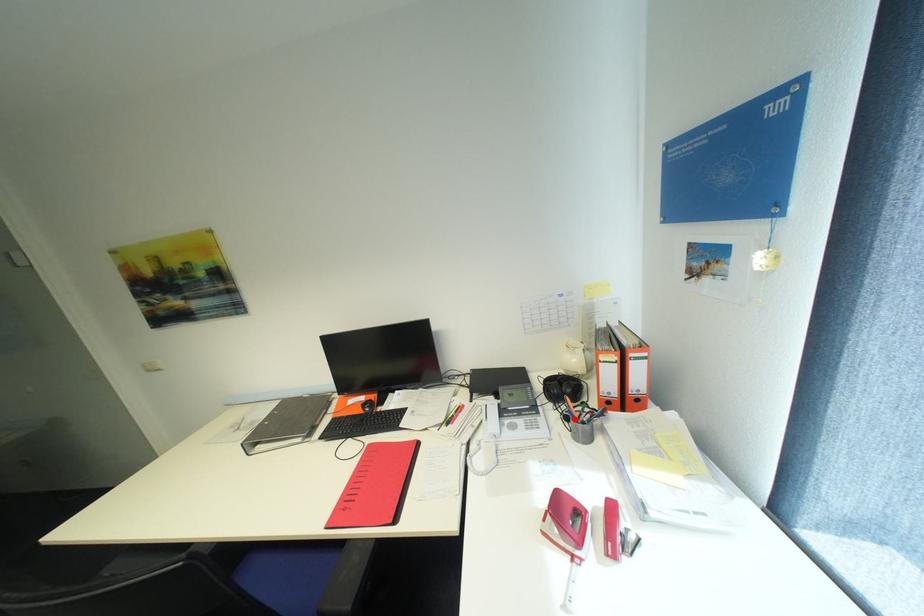
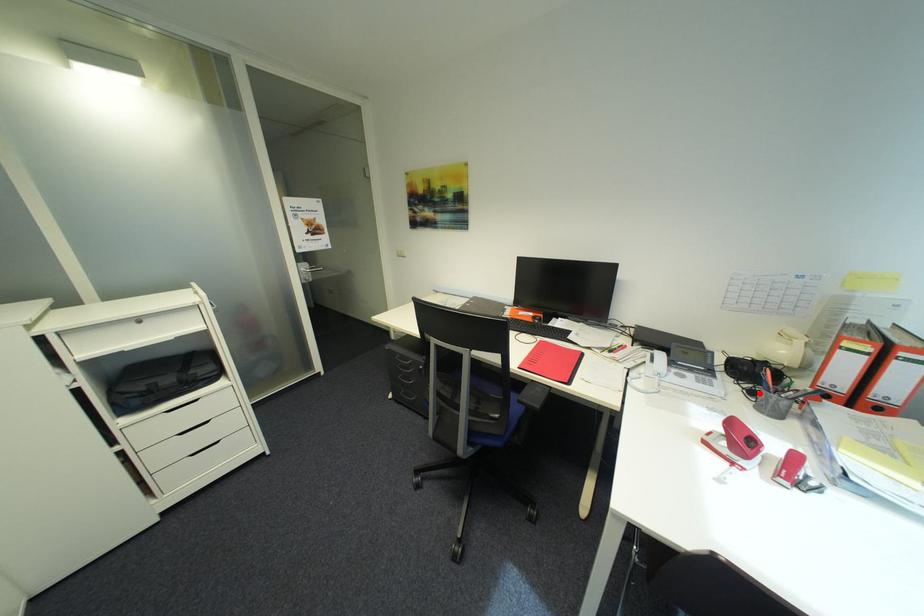
I am providing you with two images of the same scene from different viewpoints. A red point is marked on the first image and another point is marked on the second image. Does the point marked in image1 correspond to the same location as the one in image2?

Yes